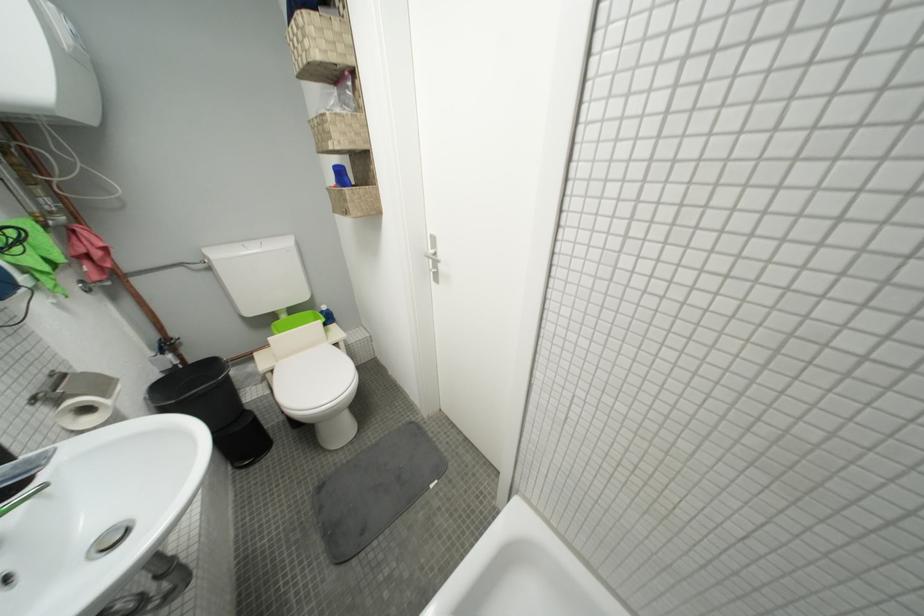
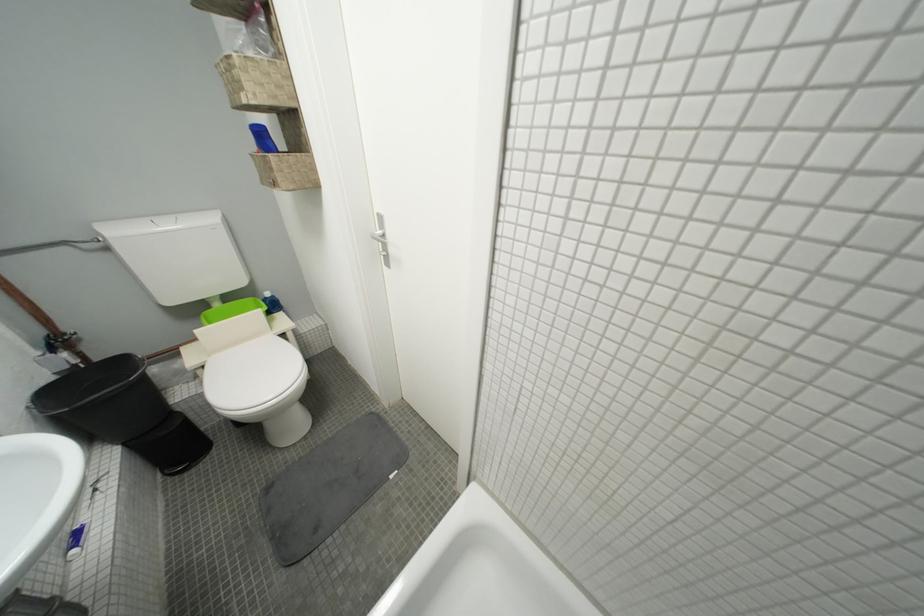
Question: How did the camera likely rotate?

Choices:
 (A) Left
 (B) Right
 (C) Up
 (D) Down

Answer: (B)